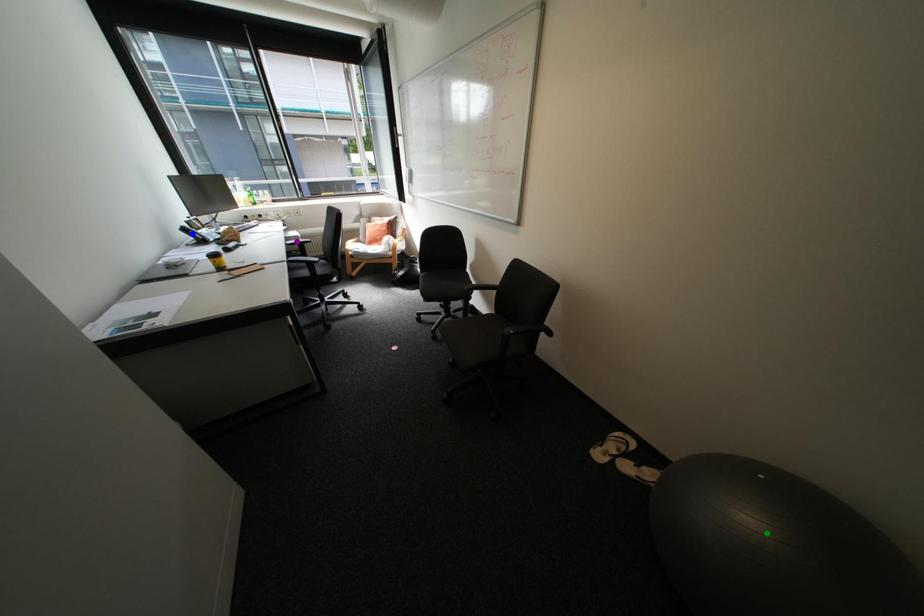
Order these from nearest to farthest:
blue point
purple point
green point

purple point < blue point < green point